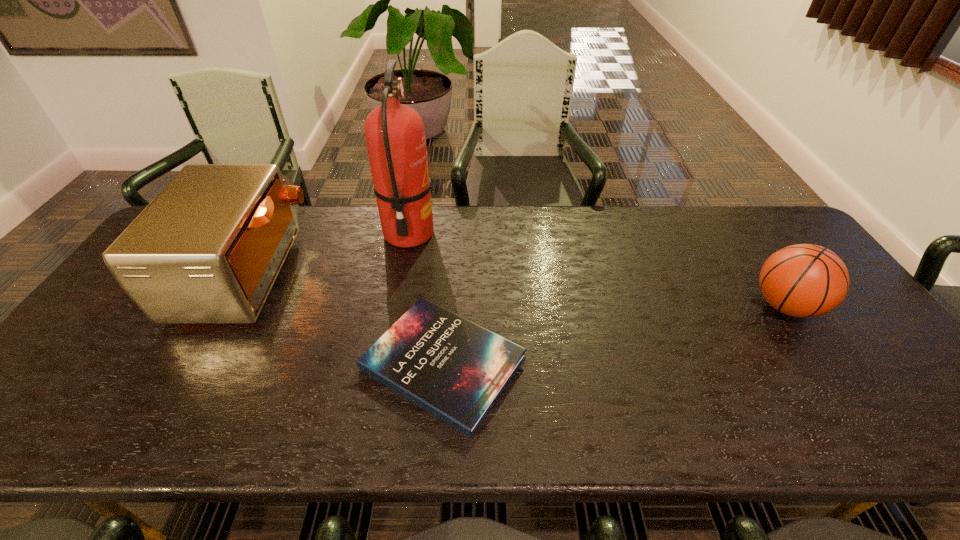
Locate an element on the screen. This screenshot has width=960, height=540. fire extinguisher that is at the far edge is located at coordinates (395, 137).

Image resolution: width=960 pixels, height=540 pixels. I want to click on toaster oven situated at the far edge, so click(x=208, y=248).

Where is `object that is at the near edge`? object that is at the near edge is located at coordinates (455, 369).

The image size is (960, 540). Find the location of `object that is at the right edge`. object that is at the right edge is located at coordinates coord(804,280).

Locate an element on the screen. The image size is (960, 540). vacant space at the far edge of the desktop is located at coordinates (353, 242).

Identify the location of free location at the near edge of the desktop. This screenshot has height=540, width=960. (329, 416).

The width and height of the screenshot is (960, 540). I want to click on blank area at the left edge, so click(x=58, y=381).

The height and width of the screenshot is (540, 960). I want to click on vacant space at the near left corner of the desktop, so click(55, 407).

Where is `unoccupied area between the second shortest object and the tallest object`? The width and height of the screenshot is (960, 540). unoccupied area between the second shortest object and the tallest object is located at coordinates (597, 270).

Image resolution: width=960 pixels, height=540 pixels. I want to click on free space between the second tallest object and the hardback book, so click(346, 319).